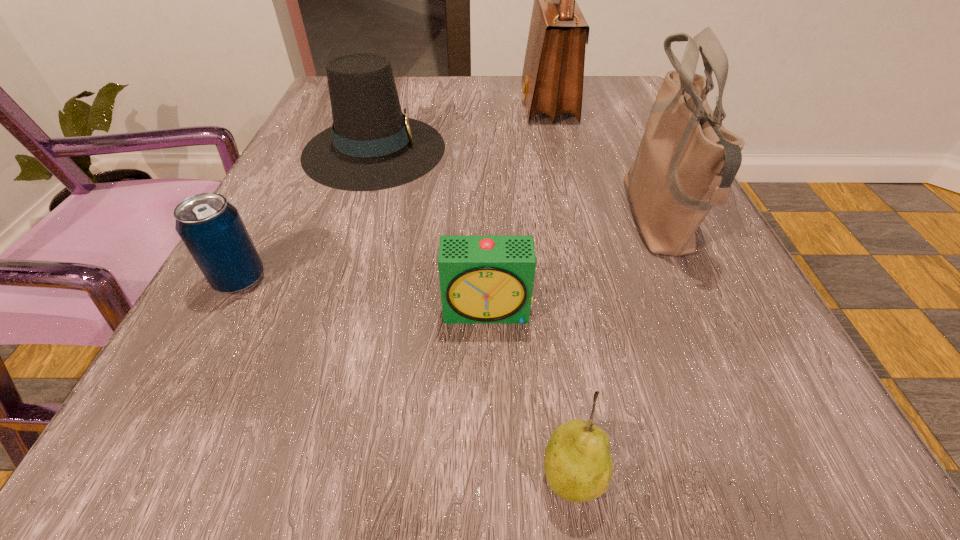
Find the location of a particular element. The width and height of the screenshot is (960, 540). vacant position in the image that satisfies the following two spatial constraints: 1. on the front side of the soda can; 2. on the left side of the pear is located at coordinates (137, 475).

You are a GUI agent. You are given a task and a screenshot of the screen. Output one action in this format:
    pyautogui.click(x=<x>, y=<y>)
    Task: Click on the free point that satisfies the following two spatial constraints: 1. on the front-facing side of the hat; 2. on the right side of the nearest object
    
    Given the screenshot: What is the action you would take?
    pyautogui.click(x=269, y=475)

You are a GUI agent. You are given a task and a screenshot of the screen. Output one action in this format:
    pyautogui.click(x=<x>, y=<y>)
    Task: Click on the vacant area that satisfies the following two spatial constraints: 1. on the front flap of the farther shoulder bag; 2. on the front-facing side of the alarm clock
    The height and width of the screenshot is (540, 960).
    Given the screenshot: What is the action you would take?
    (597, 311)